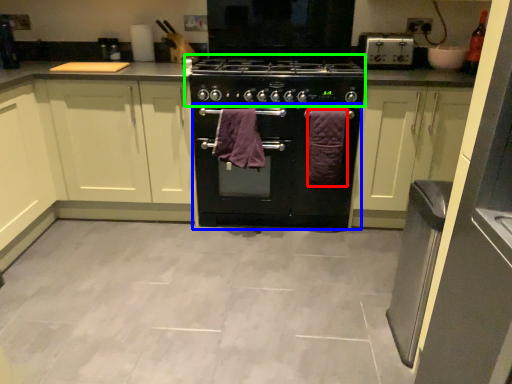
Question: Based on their relative distances, which object is nearer to bath towel (highlighted by a red box)? Choose from oven (highlighted by a blue box) and gas stove (highlighted by a green box).

Choices:
 (A) oven
 (B) gas stove

Answer: (A)